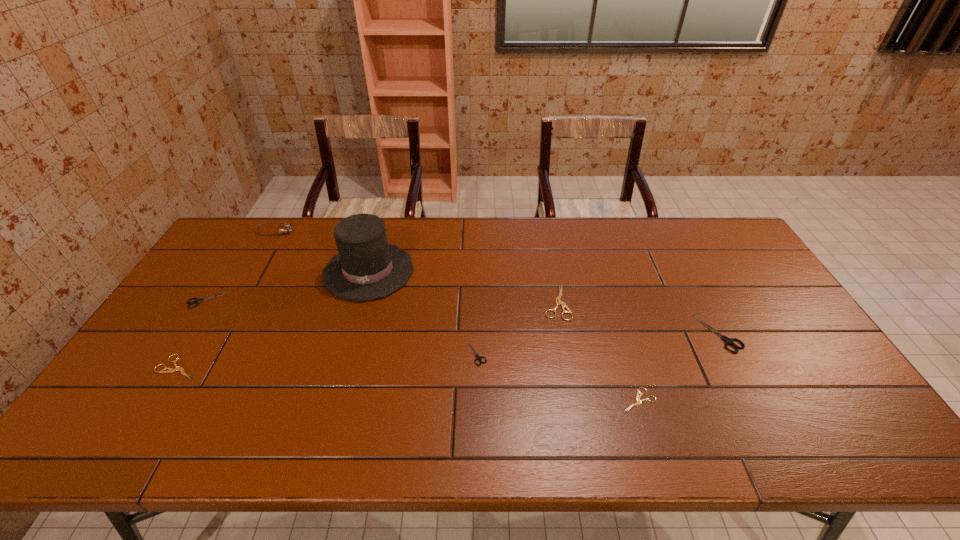
Where is `the fifth object from right to left`? The height and width of the screenshot is (540, 960). the fifth object from right to left is located at coordinates (366, 267).

Find the location of `the tallest object`. the tallest object is located at coordinates (366, 267).

You are a GUI agent. You are given a task and a screenshot of the screen. Output one action in this format:
    pyautogui.click(x=<x>, y=<y>)
    Task: Click on the farthest object
    
    Given the screenshot: What is the action you would take?
    pyautogui.click(x=286, y=228)

Identify the location of the seventh shortest object. The width and height of the screenshot is (960, 540). (286, 228).

This screenshot has height=540, width=960. Find the location of `the rightmost black shears`. the rightmost black shears is located at coordinates (728, 341).

Identify the location of the tallest shears. (728, 341).

The height and width of the screenshot is (540, 960). I want to click on the second smallest black shears, so click(197, 301).

The height and width of the screenshot is (540, 960). I want to click on the leftmost black shears, so click(x=197, y=301).

Image resolution: width=960 pixels, height=540 pixels. I want to click on the third object from right to left, so click(x=558, y=302).

Locate an element on the screen. The height and width of the screenshot is (540, 960). the second beige shears from right to left is located at coordinates (558, 302).